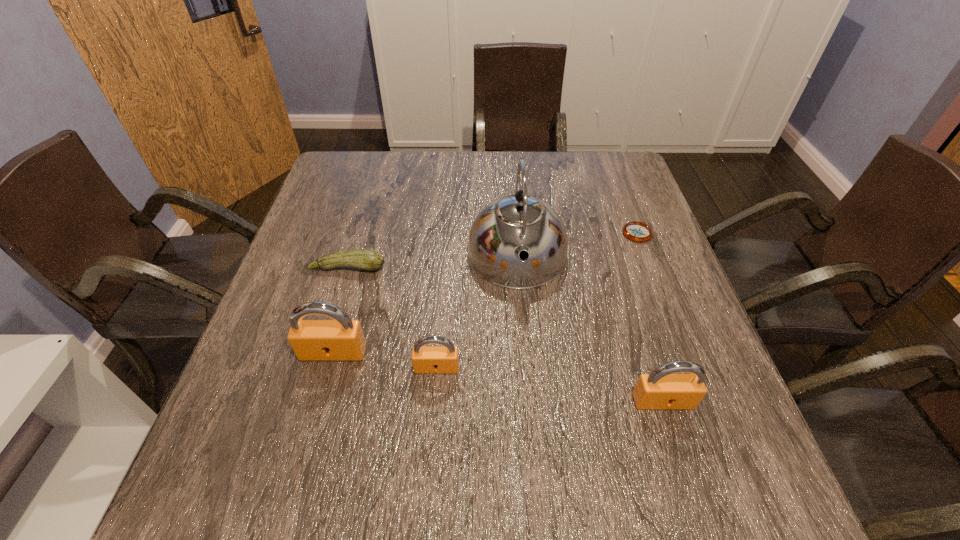
This screenshot has width=960, height=540. In order to click on free space located 0.100m to unlock the fourth object from right to left from the front in this screenshot , I will do `click(432, 423)`.

Identify the location of vacant space situated 0.140m from the spout of the tallest object. Image resolution: width=960 pixels, height=540 pixels. (525, 350).

Locate an element on the screen. The height and width of the screenshot is (540, 960). vacant space located 0.070m at the stem end of the second shortest object is located at coordinates (339, 298).

This screenshot has width=960, height=540. Find the location of `vacant space located 0.050m on the back of the shortest object`. vacant space located 0.050m on the back of the shortest object is located at coordinates (629, 211).

Where is `object that is at the near edge`? The height and width of the screenshot is (540, 960). object that is at the near edge is located at coordinates (661, 389).

Find the location of `padlock present at the left edge`. padlock present at the left edge is located at coordinates (342, 339).

Where is `zucchini situated at the left edge`? This screenshot has height=540, width=960. zucchini situated at the left edge is located at coordinates (366, 259).

Where is `padlock that is at the right edge`? The width and height of the screenshot is (960, 540). padlock that is at the right edge is located at coordinates click(661, 389).

Find the location of a particular element. Image resolution: width=960 pixels, height=540 pixels. compass located in the right edge section of the desktop is located at coordinates (636, 231).

The image size is (960, 540). What are the coordinates of `object that is at the near right corner` in the screenshot? It's located at (661, 389).